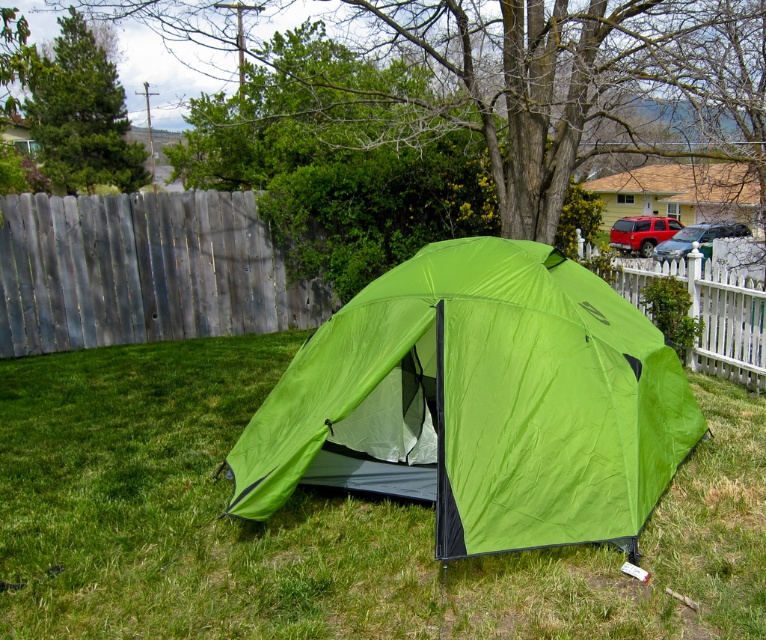
You are planning to set up a small garden bed in the area between the green grass at center and the lime green fabric tent at center. Since the garden bed requires a minimum width of 1 meter to grow vegetables, can you determine if there is enough space between them?

The green grass at center is narrower than the lime green fabric tent at center. However, the exact width of the grass is not provided, so it is uncertain if there is enough space for the garden bed. You might need to measure the actual distance between them.

In the scene shown: You are standing at the entrance of the camping tent and want to walk towards the point that is closer to you. Which point should you head towards, point (562, 460) or point (712, 326)?

Point (562, 460) is in front of point (712, 326), so you should head towards point (562, 460) as it is closer to you.

You are standing in front of the camping tent and want to place two markers at the coordinates point (254, 570) and point (205, 260). Which marker will appear closer to you when viewed from your current position?

Point (254, 570) is closer to the viewer than point (205, 260), so the marker at point (254, 570) will appear closer to you.